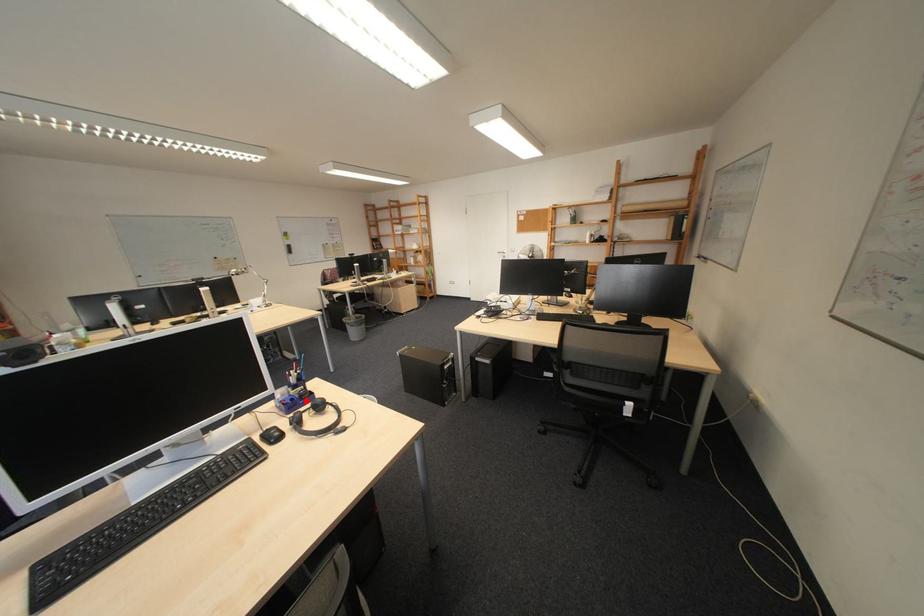
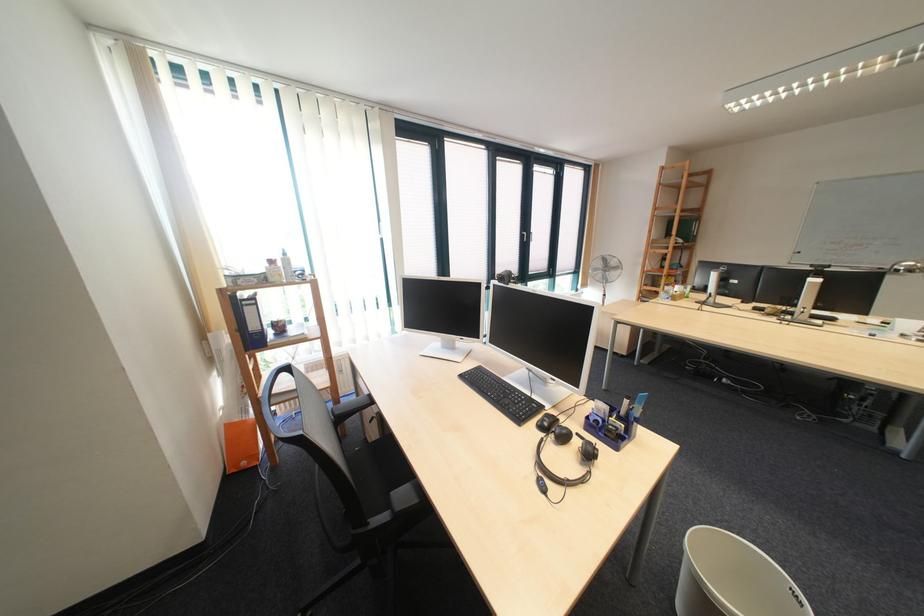
Question: I am providing you with two images of the same scene from different viewpoints. Image1 has a red point marked. In image2, the corresponding 3D location appears at what relative position? Reply with the corresponding letter.

Choices:
 (A) Closer
 (B) Farther

Answer: (B)